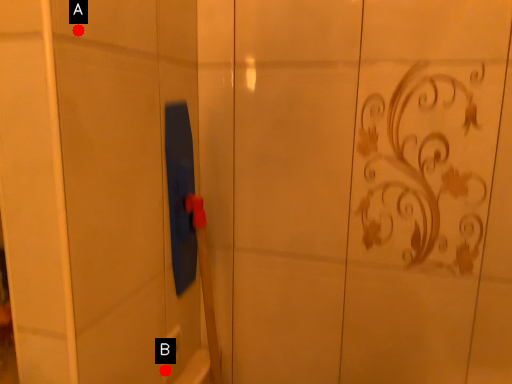
Question: Two points are circled on the image, labeled by A and B beside each circle. Which point is closer to the camera?

Choices:
 (A) A is closer
 (B) B is closer

Answer: (A)